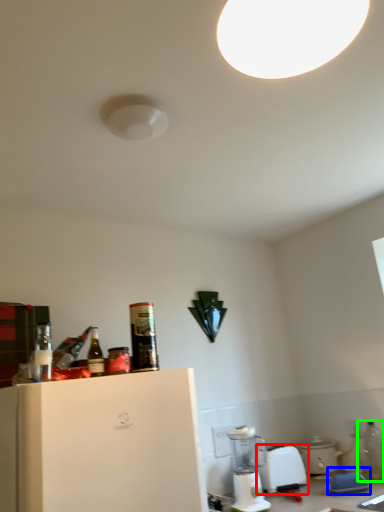
Question: Which is nearer to the kitchen appliance (highlighted by a red box)? appliance (highlighted by a blue box) or bottle (highlighted by a green box).

Choices:
 (A) appliance
 (B) bottle

Answer: (A)